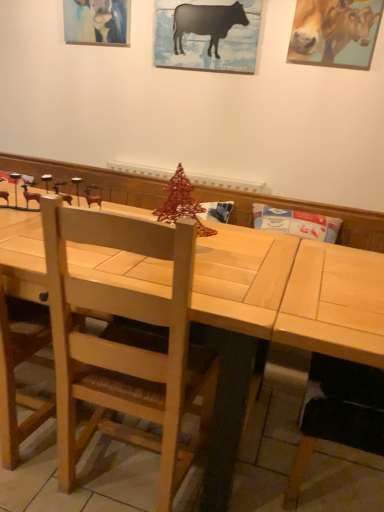
Question: Is point (109, 285) closer or farther from the camera than point (296, 330)?

Choices:
 (A) farther
 (B) closer

Answer: (A)

Question: Is light brown wooden chair at center wider or thinner than light wood table at center?

Choices:
 (A) wide
 (B) thin

Answer: (B)

Question: Based on their relative distances, which object is nearer to the matte acrylic painting at upper left?

Choices:
 (A) golden glossy cow at upper right, which is the 1th cattle from right to left
 (B) light brown wooden chair at center
 (C) light wood table at center
 (D) black matte/ceramic cow at upper center, which ranks as the 1th cattle in left-to-right order

Answer: (D)

Question: Which object is positioned closest to the black matte/ceramic cow at upper center, which ranks as the 1th cattle in left-to-right order?

Choices:
 (A) matte acrylic painting at upper left
 (B) light wood table at center
 (C) golden glossy cow at upper right, which is the 1th cattle from right to left
 (D) light brown wooden chair at center

Answer: (C)